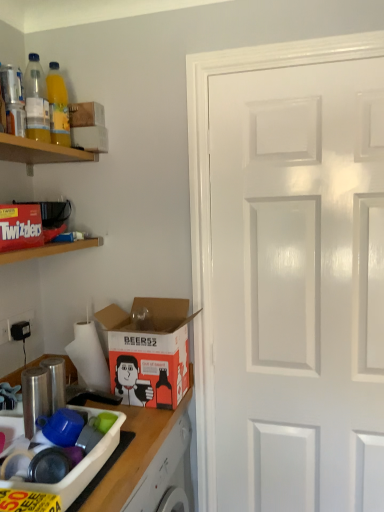
Question: Is orange matte cardboard box at lower left wider than white glossy door at right?

Choices:
 (A) yes
 (B) no

Answer: (A)

Question: Is orange matte cardboard box at lower left to the left of white glossy door at right from the viewer's perspective?

Choices:
 (A) no
 (B) yes

Answer: (B)

Question: Is orange matte cardboard box at lower left thinner than white glossy door at right?

Choices:
 (A) no
 (B) yes

Answer: (A)

Question: Considering the relative sizes of orange matte cardboard box at lower left and white glossy door at right in the image provided, is orange matte cardboard box at lower left smaller than white glossy door at right?

Choices:
 (A) yes
 (B) no

Answer: (A)

Question: Is orange matte cardboard box at lower left at the right side of white glossy door at right?

Choices:
 (A) yes
 (B) no

Answer: (B)

Question: Is orange matte cardboard box at lower left aimed at white glossy door at right?

Choices:
 (A) yes
 (B) no

Answer: (A)

Question: From a real-world perspective, is translucent plastic bottle at upper left, the second bottle in the back-to-front sequence, located higher than red matte twizzlers box at upper left, marked as the second shelf in a top-to-bottom arrangement?

Choices:
 (A) no
 (B) yes

Answer: (B)

Question: Is translucent plastic bottle at upper left, the second bottle in the back-to-front sequence, touching red matte twizzlers box at upper left, marked as the second shelf in a top-to-bottom arrangement?

Choices:
 (A) no
 (B) yes

Answer: (A)

Question: Is translucent plastic bottle at upper left, the second bottle in the back-to-front sequence, aimed at red matte twizzlers box at upper left, arranged as the first shelf when ordered from the bottom?

Choices:
 (A) yes
 (B) no

Answer: (B)

Question: Considering the relative sizes of translucent plastic bottle at upper left, the second bottle in the back-to-front sequence, and red matte twizzlers box at upper left, marked as the second shelf in a top-to-bottom arrangement, in the image provided, is translucent plastic bottle at upper left, the second bottle in the back-to-front sequence, wider than red matte twizzlers box at upper left, marked as the second shelf in a top-to-bottom arrangement,?

Choices:
 (A) yes
 (B) no

Answer: (B)

Question: Is translucent plastic bottle at upper left, the second bottle in the back-to-front sequence, completely or partially outside of red matte twizzlers box at upper left, marked as the second shelf in a top-to-bottom arrangement?

Choices:
 (A) no
 (B) yes

Answer: (B)

Question: Is translucent plastic bottle at upper left, the second bottle in the back-to-front sequence, shorter than red matte twizzlers box at upper left, marked as the second shelf in a top-to-bottom arrangement?

Choices:
 (A) yes
 (B) no

Answer: (B)

Question: Considering the relative sizes of orange matte cardboard box at lower left and white cardboard box at upper left, which ranks as the first box in back-to-front order, in the image provided, is orange matte cardboard box at lower left thinner than white cardboard box at upper left, which ranks as the first box in back-to-front order,?

Choices:
 (A) yes
 (B) no

Answer: (B)